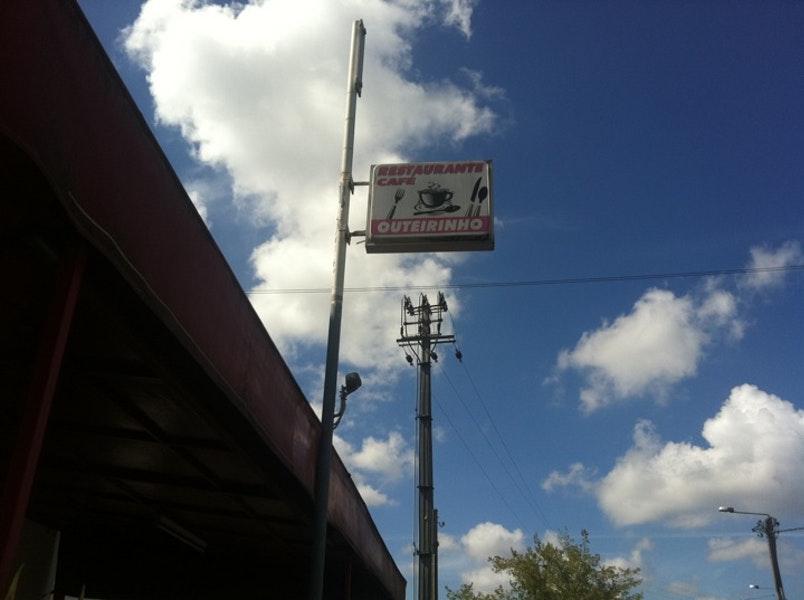
What are the coordinates of `spoon` in the screenshot? It's located at (485, 195).